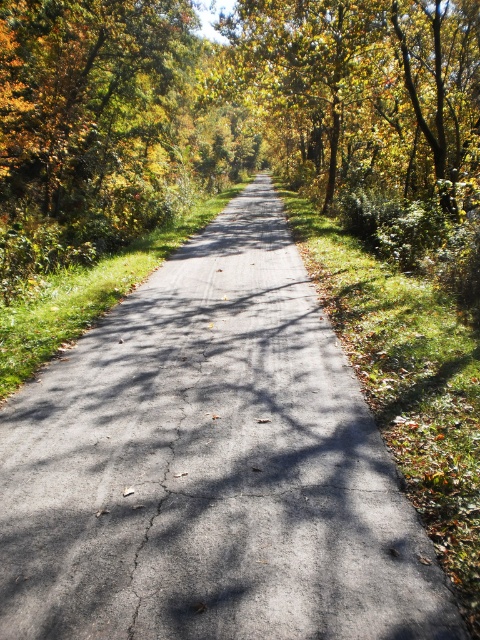
Question: Which point is farther from the camera taking this photo?

Choices:
 (A) (416, 163)
 (B) (455, 166)
 (C) (162, 381)

Answer: (A)

Question: Where is asphalt road at center located in relation to golden yellow leaves at upper center in the image?

Choices:
 (A) below
 (B) above

Answer: (A)

Question: Is golden foliage at center wider than golden yellow leaves at upper center?

Choices:
 (A) yes
 (B) no

Answer: (A)

Question: Can you confirm if golden foliage at center is smaller than golden yellow leaves at upper center?

Choices:
 (A) yes
 (B) no

Answer: (B)

Question: Among these objects, which one is nearest to the camera?

Choices:
 (A) asphalt road at center
 (B) golden foliage at center
 (C) golden yellow leaves at upper center

Answer: (A)

Question: Estimate the real-world distances between objects in this image. Which object is closer to the asphalt road at center?

Choices:
 (A) golden yellow leaves at upper center
 (B) golden foliage at center

Answer: (A)